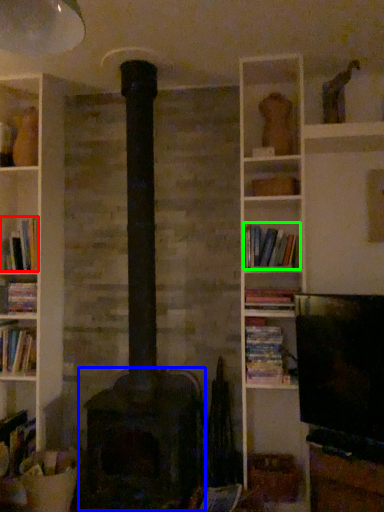
Question: Which object is the closest to the book (highlighted by a red box)? Choose among these: stove (highlighted by a blue box) or book (highlighted by a green box).

Choices:
 (A) stove
 (B) book

Answer: (A)